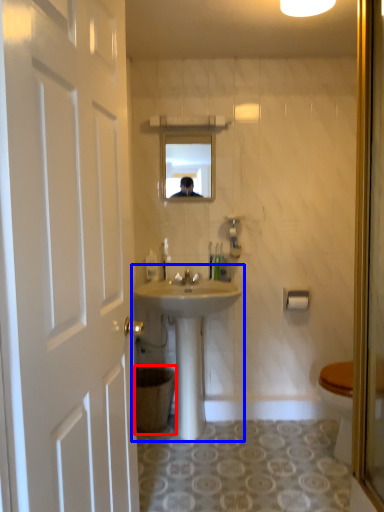
Question: Which point is further to the camera, trash bin/can (highlighted by a red box) or sink (highlighted by a blue box)?

Choices:
 (A) trash bin/can
 (B) sink

Answer: (A)